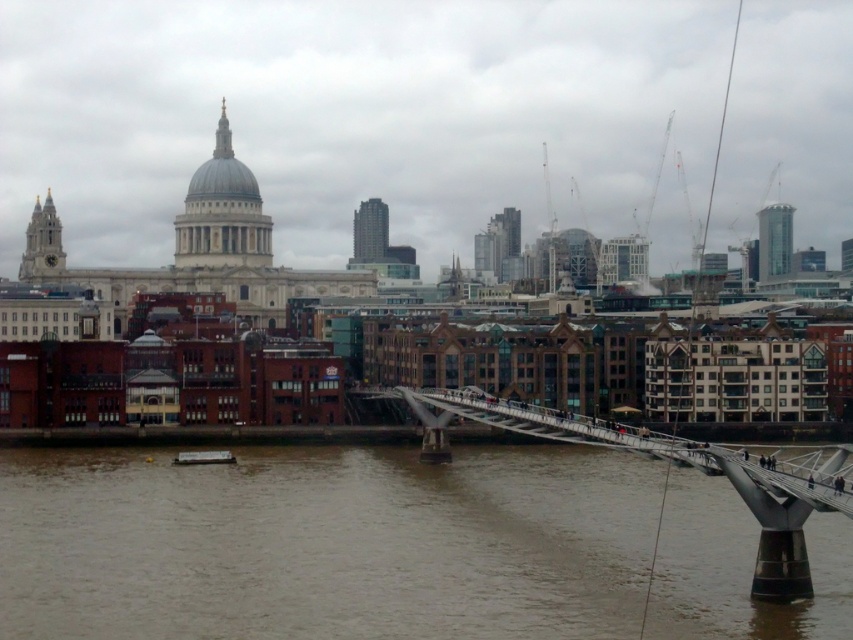
Question: Which point is closer to the camera?

Choices:
 (A) metallic silver bridge at center
 (B) brown murky water at center

Answer: (B)

Question: Is brown murky water at center to the left of metallic silver bridge at center from the viewer's perspective?

Choices:
 (A) yes
 (B) no

Answer: (A)

Question: Can you confirm if brown murky water at center is positioned to the right of metallic silver bridge at center?

Choices:
 (A) no
 (B) yes

Answer: (A)

Question: Which of the following is the closest to the observer?

Choices:
 (A) (766, 547)
 (B) (347, 480)

Answer: (A)

Question: Is brown murky water at center to the right of metallic silver bridge at center from the viewer's perspective?

Choices:
 (A) no
 (B) yes

Answer: (A)